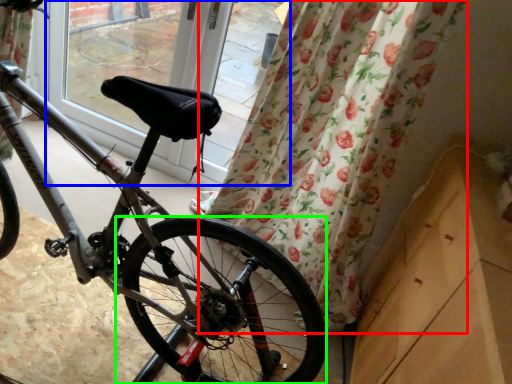
Question: Based on their relative distances, which object is farther from curtain (highlighted by a red box)? Choose from window screen (highlighted by a blue box) and wheel (highlighted by a green box).

Choices:
 (A) window screen
 (B) wheel

Answer: (A)